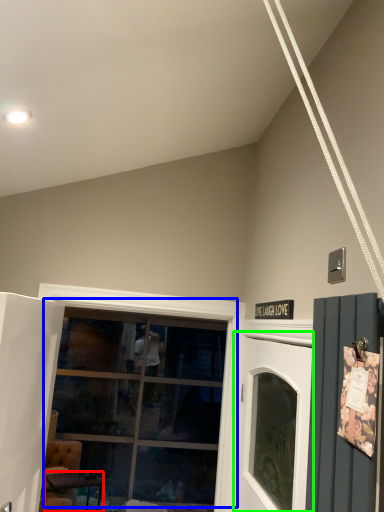
Question: Estimate the real-world distances between objects in this image. Which object is closer to table (highlighted by a red box), window (highlighted by a blue box) or garage door (highlighted by a green box)?

Choices:
 (A) window
 (B) garage door

Answer: (A)